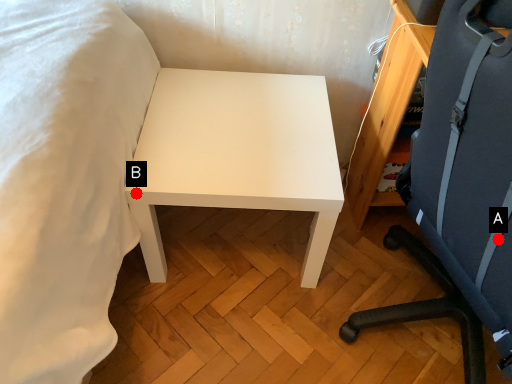
Question: Two points are circled on the image, labeled by A and B beside each circle. Which point is closer to the camera taking this photo?

Choices:
 (A) A is closer
 (B) B is closer

Answer: (A)